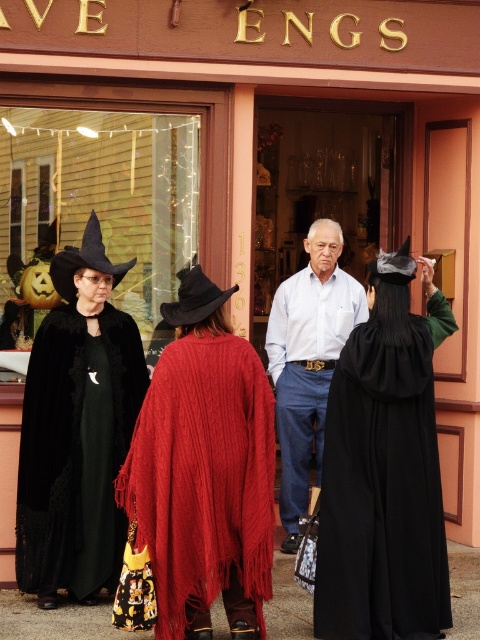
Question: Based on their relative distances, which object is farther from the black velvet cape at center?

Choices:
 (A) light blue shirt at center
 (B) black felt witch hat at left
 (C) knitted wool cape at center
 (D) velvet black cape at left

Answer: (B)

Question: Is black velvet cape at center in front of black felt witch hat at left?

Choices:
 (A) yes
 (B) no

Answer: (A)

Question: Among these points, which one is nearest to the camera?

Choices:
 (A) (74, 280)
 (B) (355, 474)
 (C) (90, 216)

Answer: (B)

Question: Is velvet black cape at left to the left of light blue shirt at center from the viewer's perspective?

Choices:
 (A) yes
 (B) no

Answer: (A)

Question: Can you confirm if black velvet cape at center is thinner than velvet black cape at left?

Choices:
 (A) yes
 (B) no

Answer: (B)

Question: Which of the following is the farthest from the observer?

Choices:
 (A) (108, 452)
 (B) (128, 493)
 (C) (113, 269)
 (D) (320, 308)

Answer: (D)